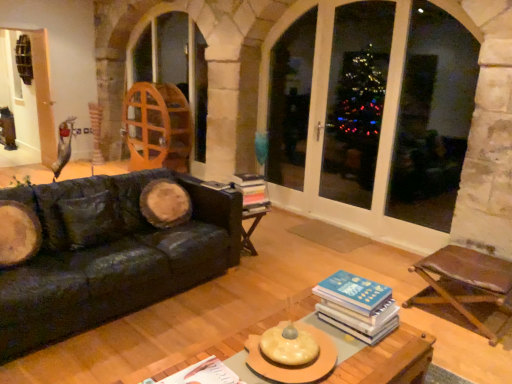
Describe the element at coordinates (432, 118) in the screenshot. I see `transparent glass window at center` at that location.

Describe the element at coordinates (42, 94) in the screenshot. The height and width of the screenshot is (384, 512). I see `wooden screen door at upper left, which appears as the 1th screen door when viewed from the back` at that location.

Image resolution: width=512 pixels, height=384 pixels. In order to click on brown leather chair at lower right in this screenshot , I will do `click(466, 284)`.

You are a GUI agent. You are given a task and a screenshot of the screen. Output one action in this format:
    pyautogui.click(x=<x>, y=<y>)
    Task: Click on the white paper book at center, the 3th book viewed from the top
    
    Given the screenshot: What is the action you would take?
    pyautogui.click(x=204, y=374)

What do you see at coordinates (371, 114) in the screenshot? The width and height of the screenshot is (512, 384). I see `transparent glass screen door at center, the 1th screen door positioned from the front` at bounding box center [371, 114].

The width and height of the screenshot is (512, 384). I want to click on transparent glass screen door at center, the second screen door positioned from the left, so click(371, 114).

Identify the location of hardcover books at center, which is the 3th book in bottom-to-top order. The width and height of the screenshot is (512, 384). (252, 194).

Are black leather couch at left and wooden coffee table at center far apart?

Yes.

Is point (111, 180) positioned after point (416, 369)?

That is True.

Considering the relative positions of black leather couch at left and wooden coffee table at center in the image provided, is black leather couch at left to the right of wooden coffee table at center from the viewer's perspective?

In fact, black leather couch at left is to the left of wooden coffee table at center.

Does wooden screen door at upper left, placed as the 2th screen door when sorted from front to back, lie in front of brown leather chair at lower right?

No, wooden screen door at upper left, placed as the 2th screen door when sorted from front to back, is further to the viewer.

Does wooden screen door at upper left, placed as the 2th screen door when sorted from front to back, have a greater width compared to brown leather chair at lower right?

No.

Is wooden screen door at upper left, placed as the 2th screen door when sorted from front to back, surrounding brown leather chair at lower right?

No, brown leather chair at lower right is not a part of wooden screen door at upper left, placed as the 2th screen door when sorted from front to back.

Is wooden screen door at upper left, the 2th screen door in the right-to-left sequence, aimed at brown leather chair at lower right?

Yes, wooden screen door at upper left, the 2th screen door in the right-to-left sequence, faces towards brown leather chair at lower right.

How much distance is there between transparent glass window at center and black leather couch at left?

transparent glass window at center is 9.96 feet from black leather couch at left.

Does transparent glass window at center have a greater width compared to black leather couch at left?

In fact, transparent glass window at center might be narrower than black leather couch at left.

From a real-world perspective, who is located higher, transparent glass window at center or black leather couch at left?

In real-world perspective, transparent glass window at center is above.

Looking at this image, is transparent glass window at center far from black leather couch at left?

Yes, transparent glass window at center and black leather couch at left are quite far apart.

Consider the image. From the image's perspective, which is above, hardcover books at center, which is the 3th book in bottom-to-top order, or black leather couch at left?

From the image's view, hardcover books at center, which is the 3th book in bottom-to-top order, is above.

From the picture: Is hardcover books at center, which is the second book from left to right, thinner than black leather couch at left?

Correct, the width of hardcover books at center, which is the second book from left to right, is less than that of black leather couch at left.

From a real-world perspective, which object rests below the other?

black leather couch at left.

Are hardcover books at center, positioned as the 3th book in front-to-back order, and black leather couch at left making contact?

No, hardcover books at center, positioned as the 3th book in front-to-back order, is not with black leather couch at left.

From a real-world perspective, which is physically below, transparent glass screen door at center, positioned as the second screen door in back-to-front order, or wooden coffee table at center?

wooden coffee table at center.

From the image's perspective, would you say transparent glass screen door at center, the second screen door positioned from the left, is shown under wooden coffee table at center?

No.

Where is `table in front of the transparent glass screen door at center, the 1th screen door positioned from the front`? table in front of the transparent glass screen door at center, the 1th screen door positioned from the front is located at coordinates (390, 360).

At what (x,y) coordinates should I click in order to perform the action: click on screen door that is on the right side of hardcover books at center, which is the second book from left to right. Please return your answer as a coordinate pair (x, y). The height and width of the screenshot is (384, 512). Looking at the image, I should click on (371, 114).

Which is more to the right, transparent glass screen door at center, the 1th screen door positioned from the front, or hardcover books at center, placed as the 2th book when sorted from right to left?

From the viewer's perspective, transparent glass screen door at center, the 1th screen door positioned from the front, appears more on the right side.

Consider the image. Is hardcover books at center, positioned as the 3th book in front-to-back order, at the back of transparent glass screen door at center, the 1th screen door positioned from the front?

Yes.

Measure the distance from transparent glass screen door at center, the second screen door positioned from the left, to hardcover books at center, the first book in the back-to-front sequence.

1.56 meters.

Is white paper book at center, the 1th book when ordered from left to right, oriented towards black leather couch at left?

Yes.

Does white paper book at center, marked as the 1th book in a front-to-back arrangement, come in front of black leather couch at left?

Yes, the depth of white paper book at center, marked as the 1th book in a front-to-back arrangement, is less than that of black leather couch at left.

From the image's perspective, who appears lower, white paper book at center, marked as the 1th book in a front-to-back arrangement, or black leather couch at left?

white paper book at center, marked as the 1th book in a front-to-back arrangement, from the image's perspective.

How much distance is there between white paper book at center, the 1th book when ordered from left to right, and black leather couch at left?

white paper book at center, the 1th book when ordered from left to right, and black leather couch at left are 1.48 meters apart from each other.

At what (x,y) coordinates should I click in order to perform the action: click on table that appears on the right of black leather couch at left. Please return your answer as a coordinate pair (x, y). Looking at the image, I should click on (390, 360).

From the image's perspective, count 2nd screen doors upward from the brown leather chair at lower right and point to it. Please provide its 2D coordinates.

[(42, 94)]

Looking at this image, looking at the image, which one is located further to brown leather chair at lower right, transparent glass window at center or white paper book at center, the 3th book viewed from the top?

Among the two, white paper book at center, the 3th book viewed from the top, is located further to brown leather chair at lower right.

When comparing their distances from wooden coffee table at center, does transparent glass window at center or brown leather chair at lower right seem closer?

The object closer to wooden coffee table at center is brown leather chair at lower right.

Which object lies further to the anchor point wooden screen door at upper left, placed as the 2th screen door when sorted from front to back, brown leather chair at lower right or wooden coffee table at center?

wooden coffee table at center is further to wooden screen door at upper left, placed as the 2th screen door when sorted from front to back.

Estimate the real-world distances between objects in this image. Which object is closer to transparent glass window at center, wooden coffee table at center or hardcover books at center, the first book in the back-to-front sequence?

Based on the image, hardcover books at center, the first book in the back-to-front sequence, appears to be nearer to transparent glass window at center.

Considering their positions, is white paper book at center, marked as the 1th book in a front-to-back arrangement, positioned closer to wooden screen door at upper left, placed as the 2th screen door when sorted from front to back, than black leather couch at left?

black leather couch at left is closer to wooden screen door at upper left, placed as the 2th screen door when sorted from front to back.

In the scene shown: Considering their positions, is blue hardcover book at center, the 2th book ordered from the bottom, positioned closer to brown leather chair at lower right than transparent glass screen door at center, the second screen door positioned from the left?

blue hardcover book at center, the 2th book ordered from the bottom.

Estimate the real-world distances between objects in this image. Which object is closer to wooden coffee table at center, black leather couch at left or transparent glass screen door at center, positioned as the second screen door in back-to-front order?

The object closer to wooden coffee table at center is black leather couch at left.

When comparing their distances from wooden screen door at upper left, the 2th screen door in the right-to-left sequence, does black leather couch at left or white paper book at center, the 3th book viewed from the top, seem further?

white paper book at center, the 3th book viewed from the top.

Image resolution: width=512 pixels, height=384 pixels. What are the coordinates of `table between black leather couch at left and brown leather chair at lower right` in the screenshot? It's located at (390, 360).

Find the location of `chair between wooden coffee table at center and transparent glass window at center along the z-axis`. chair between wooden coffee table at center and transparent glass window at center along the z-axis is located at coordinates (466, 284).

The width and height of the screenshot is (512, 384). What are the coordinates of `chair between white paper book at center, the 1th book when ordered from left to right, and transparent glass window at center from left to right` in the screenshot? It's located at (466, 284).

At what (x,y) coordinates should I click in order to perform the action: click on studio couch positioned between white paper book at center, marked as the 1th book in a front-to-back arrangement, and wooden screen door at upper left, which appears as the 1th screen door when viewed from the back, from near to far. Please return your answer as a coordinate pair (x, y). Looking at the image, I should click on (110, 255).